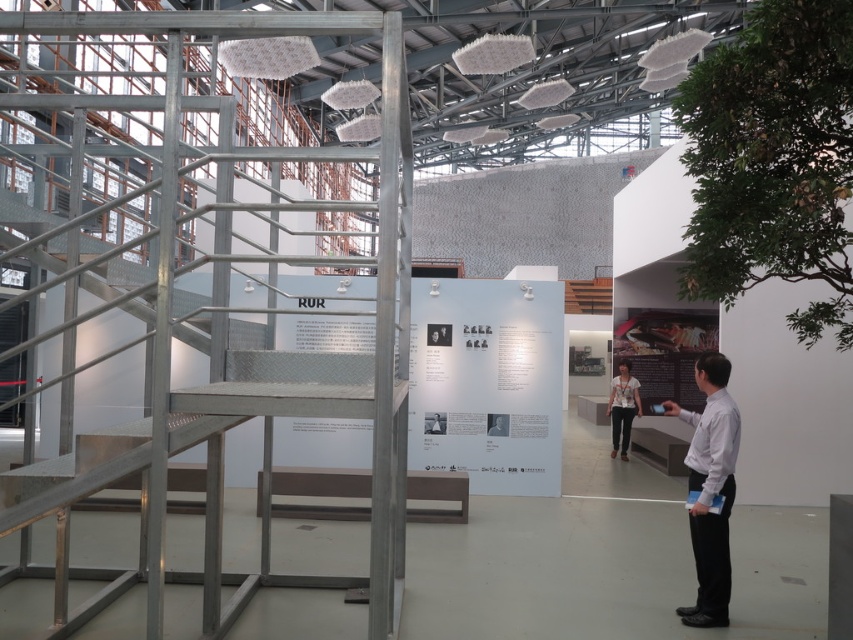
You are an attendee at the exhibition and want to take a photo of the white shirt at right and the wooden stairs at center. Since you want to include both in the frame, can you position yourself in a way that both objects are visible in your camera view?

The white shirt at right is below the wooden stairs at center, so you can position yourself at a lower angle to capture both the white shirt at right and the wooden stairs at center in the same frame.

You are standing in the exhibition space and want to locate the white printed shirt at center. According to the coordinates provided, where would you find it in the image?

The white printed shirt at center is located at the coordinates point (622, 406) in the image.